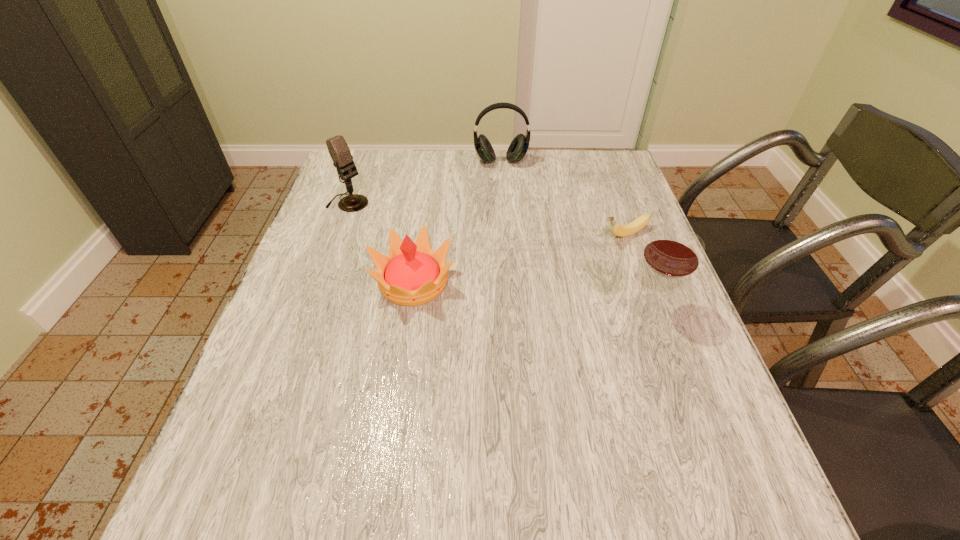
What are the coordinates of `object at the far edge` in the screenshot? It's located at (518, 148).

The image size is (960, 540). In order to click on object positioned at the left edge in this screenshot , I will do `click(339, 151)`.

Where is `wineglass present at the right edge`? Image resolution: width=960 pixels, height=540 pixels. wineglass present at the right edge is located at coordinates (672, 252).

Find the location of a particular element. This screenshot has width=960, height=540. banana present at the right edge is located at coordinates (629, 229).

The width and height of the screenshot is (960, 540). Find the location of `free space at the far edge`. free space at the far edge is located at coordinates (445, 186).

Where is `vacant space at the near edge`? The height and width of the screenshot is (540, 960). vacant space at the near edge is located at coordinates (505, 426).

Locate an element on the screen. This screenshot has width=960, height=540. vacant space at the left edge of the desktop is located at coordinates (335, 266).

Find the location of a particular element. This screenshot has width=960, height=540. vacant space at the right edge of the desktop is located at coordinates (621, 339).

In the image, there is a desktop. At what (x,y) coordinates should I click in order to perform the action: click on vacant region at the far left corner. Please return your answer as a coordinate pair (x, y). Image resolution: width=960 pixels, height=540 pixels. Looking at the image, I should click on (357, 185).

Identify the location of free space at the far right corner of the desktop. Image resolution: width=960 pixels, height=540 pixels. (602, 178).